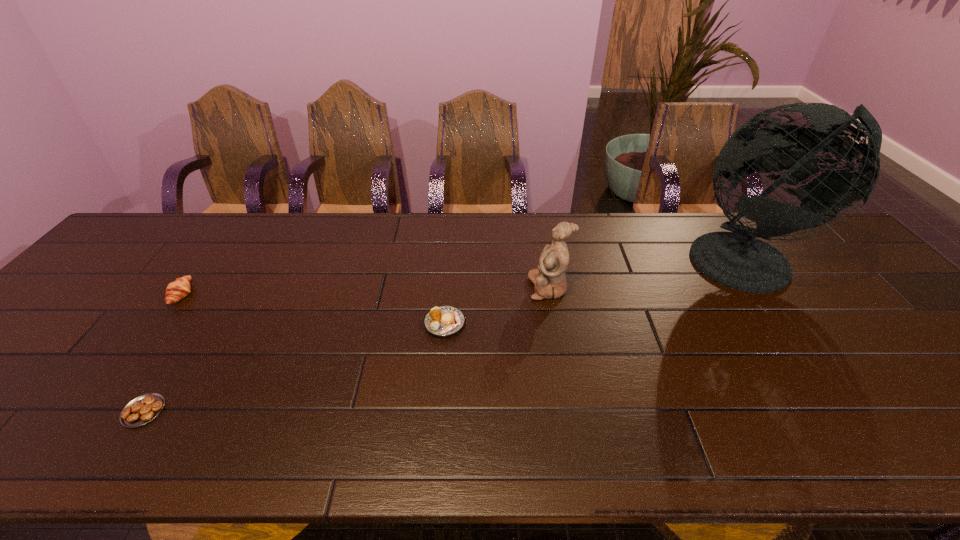
You are a GUI agent. You are given a task and a screenshot of the screen. Output one action in this format:
    pyautogui.click(x=<x>, y=<y>)
    Task: Click on the rightmost object
    
    Given the screenshot: What is the action you would take?
    pyautogui.click(x=737, y=260)

The width and height of the screenshot is (960, 540). Find the location of `the tallest object`. the tallest object is located at coordinates click(737, 260).

This screenshot has width=960, height=540. Find the location of `figurine`. figurine is located at coordinates (549, 279).

The width and height of the screenshot is (960, 540). I want to click on the fourth object from left to right, so click(x=549, y=279).

Locate an element on the screen. Image resolution: width=960 pixels, height=540 pixels. the tallest pastry is located at coordinates (180, 288).

The width and height of the screenshot is (960, 540). I want to click on the third shortest object, so click(x=180, y=288).

Locate an element on the screen. This screenshot has height=540, width=960. the third object from left to right is located at coordinates (445, 320).

At what (x,y) coordinates should I click in order to perform the action: click on the rightmost pastry. Please return your answer as a coordinate pair (x, y). The image size is (960, 540). Looking at the image, I should click on (445, 320).

This screenshot has width=960, height=540. In order to click on the nearest object in this screenshot , I will do `click(143, 409)`.

In order to click on the shortest pastry in this screenshot , I will do `click(143, 409)`.